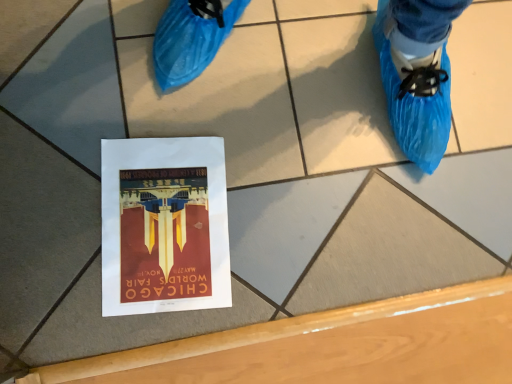
This screenshot has width=512, height=384. In order to click on empty space that is ontop of matte paper poster at center (from a real-world perspective) in this screenshot , I will do `click(164, 223)`.